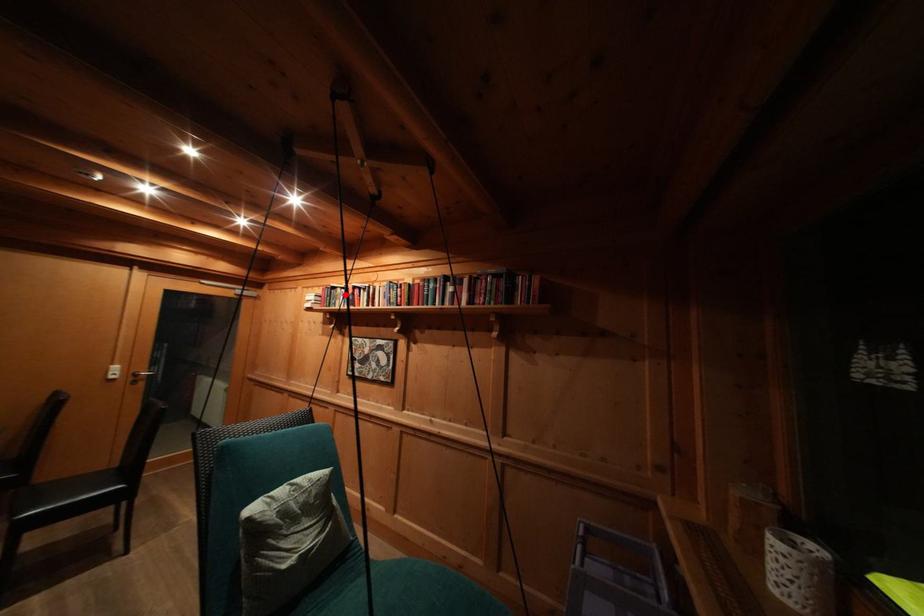
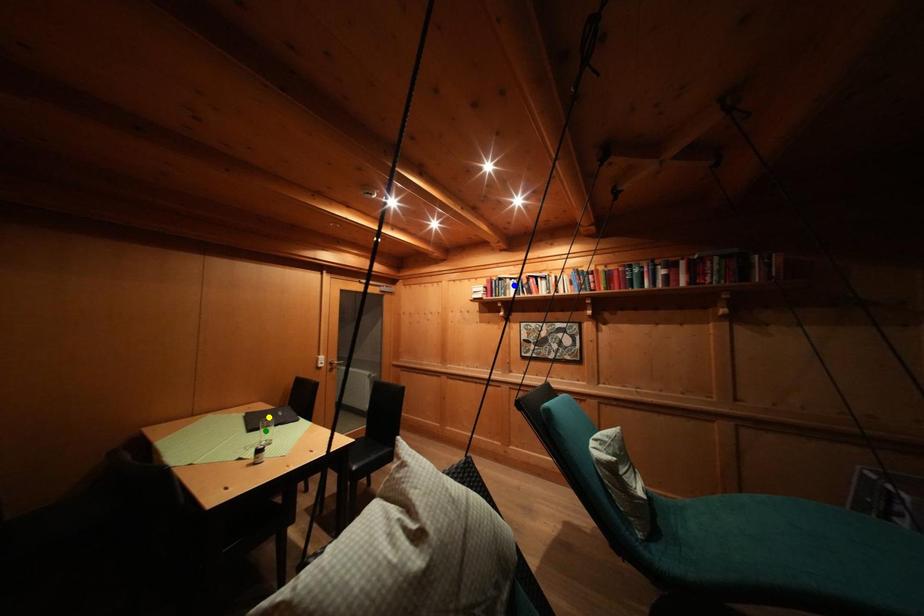
Question: I am providing you with two images of the same scene from different viewpoints. A red point is marked on the first image. You are given multiple points on the second image. Which point in image 2 represents the same 3d spot as the red point in image 1?

Choices:
 (A) yellow point
 (B) blue point
 (C) green point

Answer: (B)